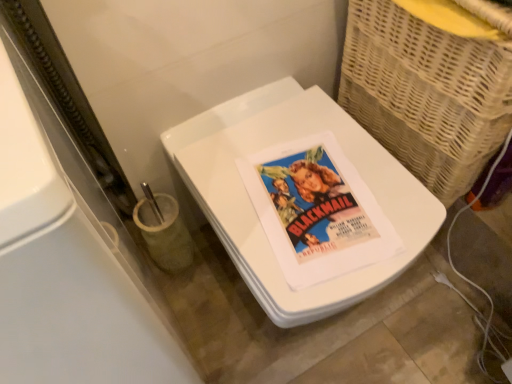
In order to click on empty space that is ontop of matte paper poster at center (from a real-world perspective) in this screenshot , I will do `click(320, 196)`.